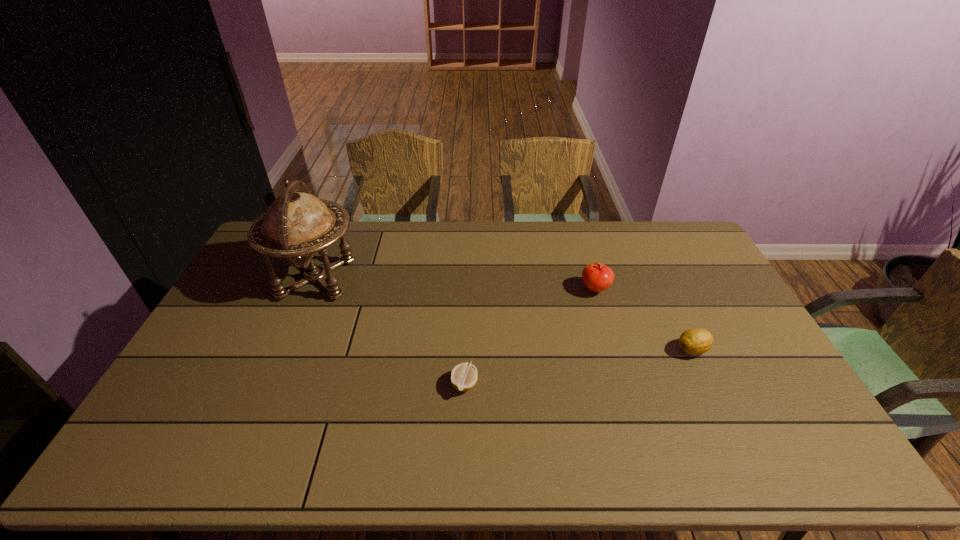
Locate an element on the screen. This screenshot has height=540, width=960. free space between the third object from right to left and the apple is located at coordinates click(530, 336).

This screenshot has height=540, width=960. I want to click on blank region between the rightmost object and the second object from left to right, so click(579, 367).

The image size is (960, 540). In order to click on vacant space that is in between the farther lemon and the third object from left to right in this screenshot , I will do `click(644, 319)`.

Find the location of a particular element. This screenshot has width=960, height=540. object that stands as the third closest to the tallest object is located at coordinates (695, 341).

I want to click on object that stands as the closest to the apple, so click(x=695, y=341).

The image size is (960, 540). In order to click on vacant space that satisfies the following two spatial constraints: 1. at the stem end of the farther lemon; 2. on the front side of the second object from left to right in this screenshot , I will do `click(708, 384)`.

Image resolution: width=960 pixels, height=540 pixels. I want to click on free spot that satisfies the following two spatial constraints: 1. on the back side of the left lemon; 2. on the front-facing side of the leftmost object, so click(468, 279).

Identify the location of free space that satisfies the following two spatial constraints: 1. on the front-facing side of the nearest object; 2. on the right side of the tallest object. This screenshot has height=540, width=960. (272, 384).

Identify the location of free spot that satisfies the following two spatial constraints: 1. on the front-facing side of the third object from right to left; 2. on the right side of the tallest object. Image resolution: width=960 pixels, height=540 pixels. (272, 384).

The width and height of the screenshot is (960, 540). In order to click on free space that satisfies the following two spatial constraints: 1. on the front-facing side of the globe; 2. on the right side of the apple in this screenshot , I will do `click(312, 289)`.